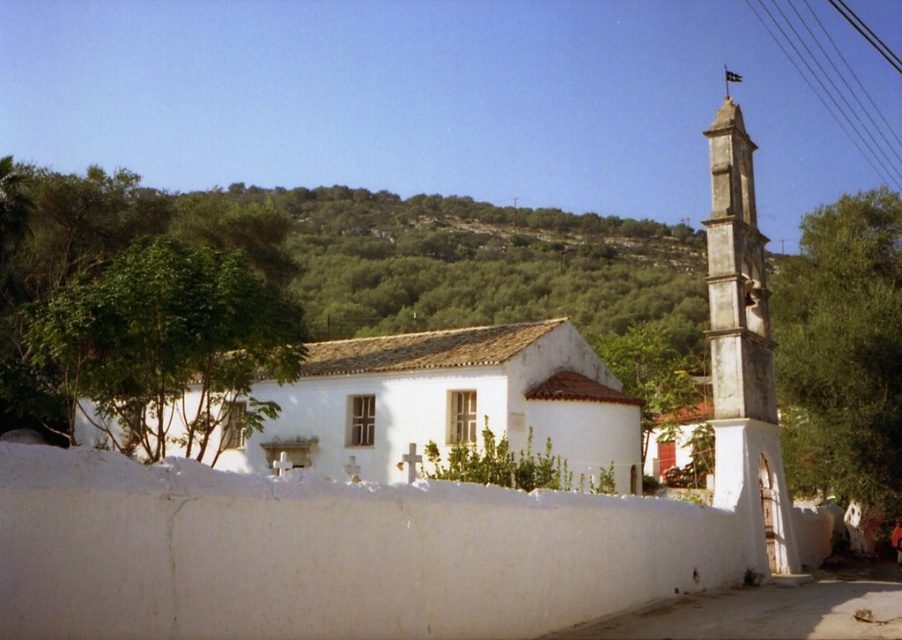
Measure the distance from white matte church at center to green leafy tree at left.

They are 24.65 feet apart.

Does point (462, 362) lie behind point (181, 275)?

Yes, it is behind point (181, 275).

Is point (581, 358) positioned in front of point (130, 452)?

Yes, it is in front of point (130, 452).

You are a GUI agent. You are given a task and a screenshot of the screen. Output one action in this format:
    pyautogui.click(x=<x>, y=<y>)
    Task: Click on the white matte church at center
    This screenshot has width=902, height=640.
    Given the screenshot: What is the action you would take?
    pyautogui.click(x=446, y=403)

Does white matte church at center have a larger size compared to white stone tower at right?

No, white matte church at center is not bigger than white stone tower at right.

Is white matte church at center to the right of white stone tower at right from the viewer's perspective?

No, white matte church at center is not to the right of white stone tower at right.

Is point (324, 346) in front of point (755, 353)?

No, (324, 346) is behind (755, 353).

At what (x,y) coordinates should I click in order to perform the action: click on white matte church at center. Please return your answer as a coordinate pair (x, y). Looking at the image, I should click on (446, 403).

Which of these two, green leafy tree at left or white stone tower at right, stands shorter?

Standing shorter between the two is green leafy tree at left.

This screenshot has height=640, width=902. Identify the location of green leafy tree at left. (167, 344).